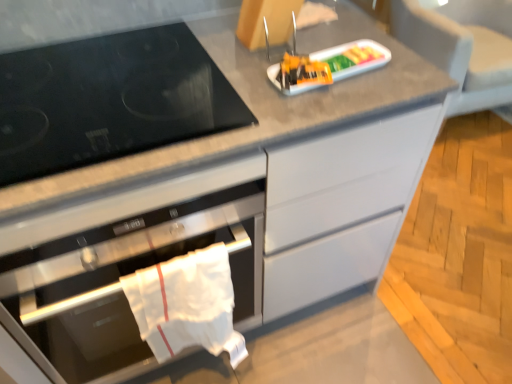
I want to click on vacant space to the right of plastic tray at center, so click(x=398, y=68).